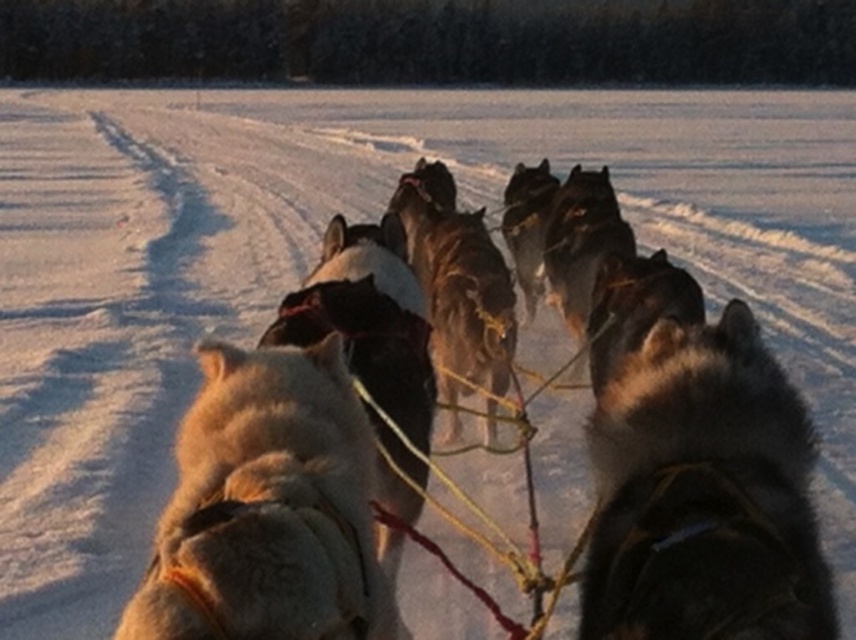
Is black fur dog at center taller than fuzzy white dog at center?

In fact, black fur dog at center may be shorter than fuzzy white dog at center.

At what (x,y) coordinates should I click in order to perform the action: click on black fur dog at center. Please return your answer as a coordinate pair (x, y). The width and height of the screenshot is (856, 640). Looking at the image, I should click on (703, 493).

Between point (651, 376) and point (367, 609), which one is positioned behind?

Point (651, 376)

Identify the location of black fur dog at center. (703, 493).